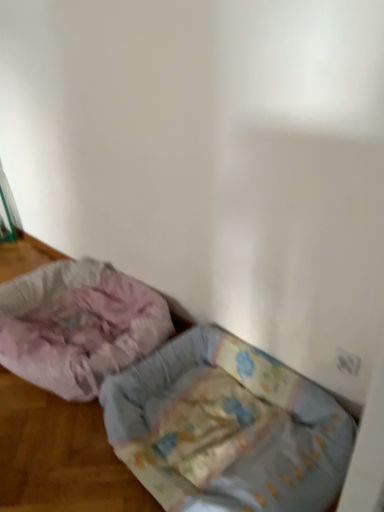
Question: Considering the positions of fluffy pink fabric dog bed at lower left, placed as the 2th dog bed when sorted from right to left, and fluffy fabric dog bed at lower left, positioned as the first dog bed in right-to-left order, in the image, is fluffy pink fabric dog bed at lower left, placed as the 2th dog bed when sorted from right to left, taller or shorter than fluffy fabric dog bed at lower left, positioned as the first dog bed in right-to-left order,?

Choices:
 (A) short
 (B) tall

Answer: (A)

Question: Looking at the image, does fluffy pink fabric dog bed at lower left, the 1th dog bed viewed from the left, seem bigger or smaller compared to fluffy fabric dog bed at lower left, the 2th dog bed when ordered from left to right?

Choices:
 (A) small
 (B) big

Answer: (B)

Question: Is fluffy pink fabric dog bed at lower left, the 1th dog bed viewed from the left, inside or outside of fluffy fabric dog bed at lower left, positioned as the first dog bed in right-to-left order?

Choices:
 (A) inside
 (B) outside

Answer: (B)

Question: Is fluffy fabric dog bed at lower left, the 2th dog bed when ordered from left to right, inside or outside of fluffy pink fabric dog bed at lower left, the 1th dog bed viewed from the left?

Choices:
 (A) outside
 (B) inside

Answer: (A)

Question: From the image's perspective, is fluffy fabric dog bed at lower left, the 2th dog bed when ordered from left to right, above or below fluffy pink fabric dog bed at lower left, the 1th dog bed viewed from the left?

Choices:
 (A) above
 (B) below

Answer: (B)

Question: From a real-world perspective, is fluffy fabric dog bed at lower left, the 2th dog bed when ordered from left to right, physically located above or below fluffy pink fabric dog bed at lower left, the 1th dog bed viewed from the left?

Choices:
 (A) below
 (B) above

Answer: (A)

Question: Is fluffy fabric dog bed at lower left, the 2th dog bed when ordered from left to right, bigger or smaller than fluffy pink fabric dog bed at lower left, placed as the 2th dog bed when sorted from right to left?

Choices:
 (A) small
 (B) big

Answer: (A)